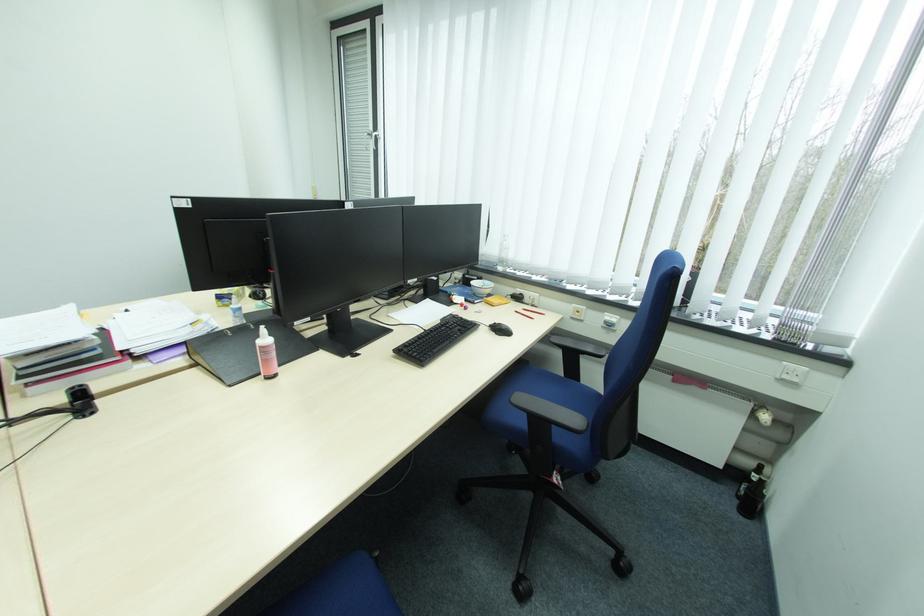
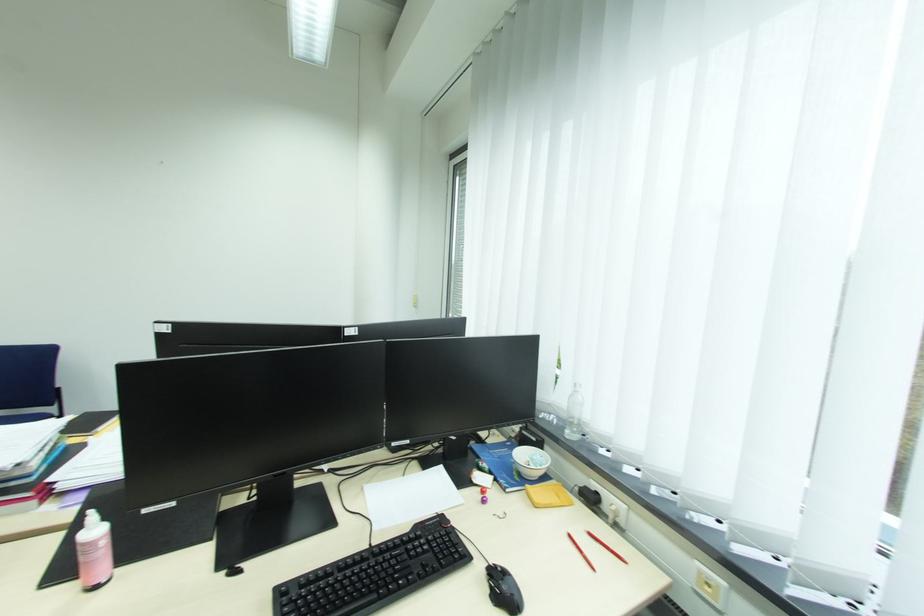
Question: How did the camera likely rotate?

Choices:
 (A) Left
 (B) Right
 (C) Up
 (D) Down

Answer: (A)